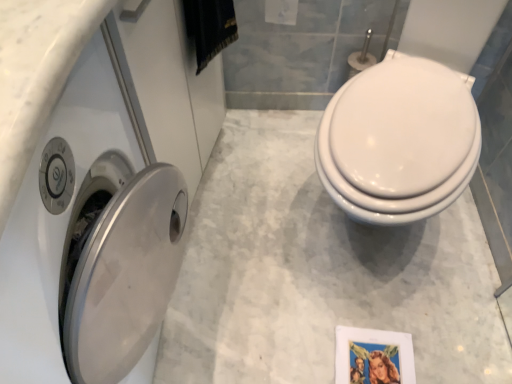
Find the location of a particular element. vacant region above metallic silver picture frame at lower right (from a real-world perspective) is located at coordinates (378, 363).